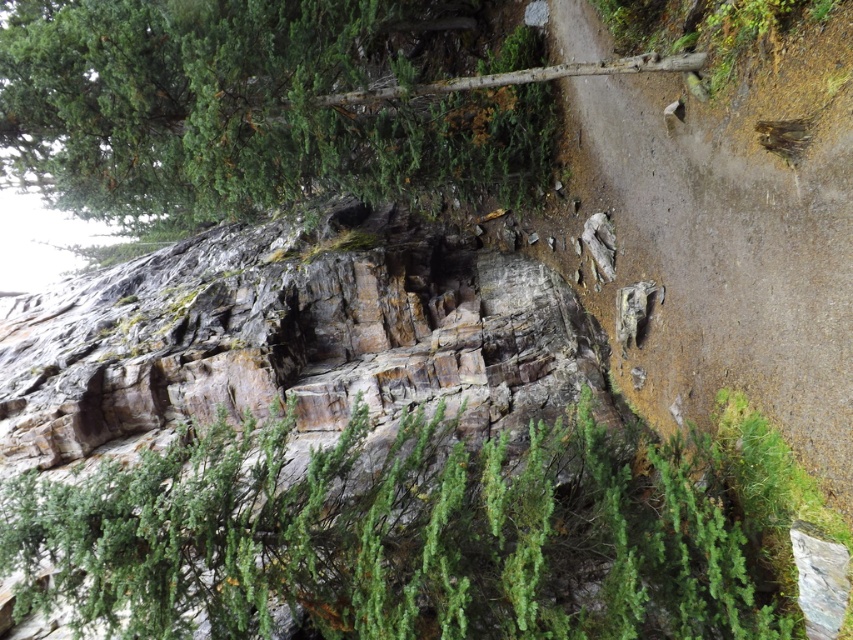
Between green textured tree at upper left and dirt/gravel mountain path at center, which one appears on the left side from the viewer's perspective?

green textured tree at upper left

Can you confirm if green textured tree at upper left is positioned to the right of dirt/gravel mountain path at center?

Incorrect, green textured tree at upper left is not on the right side of dirt/gravel mountain path at center.

Which is in front, point (415, 68) or point (820, 134)?

Point (820, 134) is more forward.

Locate an element on the screen. This screenshot has width=853, height=640. green textured tree at upper left is located at coordinates (263, 104).